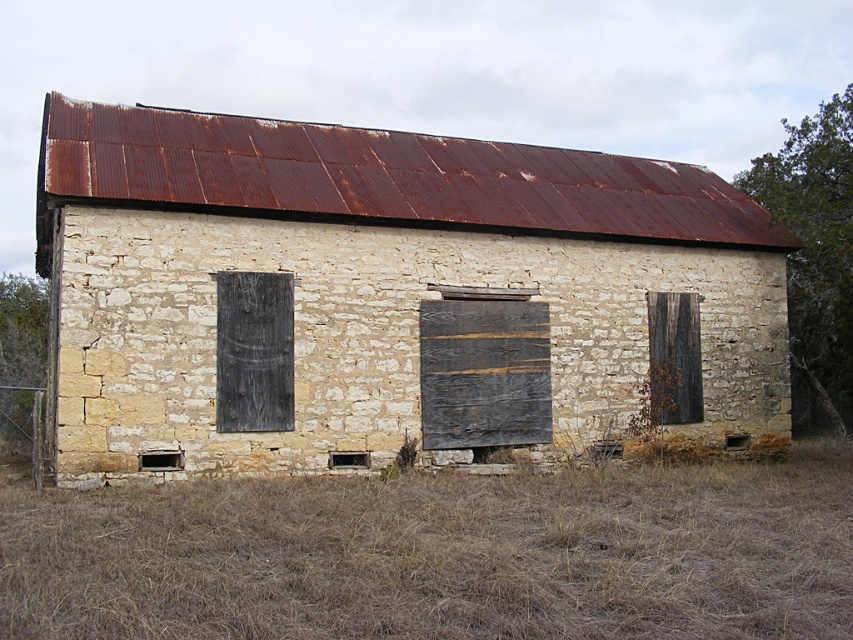
From the picture: You are standing in front of an old stone building with a rusted metal roof. You see a point at coordinates (440, 554). What is located at that point?

The point at coordinates (440, 554) corresponds to brown grass at lower center.

You are a painter assessing the building to estimate the materials needed. You need to know which object is wider between the rusty corrugated metal roof at upper center and the dark brown wooden door at right. Which one is wider?

The rusty corrugated metal roof at upper center is wider than the dark brown wooden door at right according to the description.

You are standing at the entrance of the old stone building and want to check the condition of the rusty corrugated metal roof at upper center. From your current position, in which direction should you look to see the roof?

The rusty corrugated metal roof at upper center is located at point coordinates that are near the center of the image, so you should look upward and towards the middle of the building to see it.